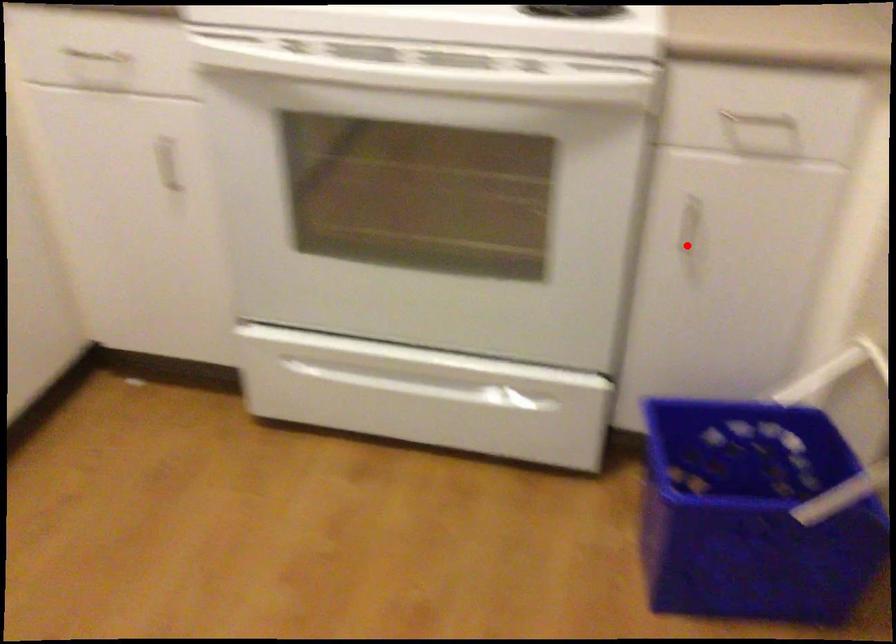
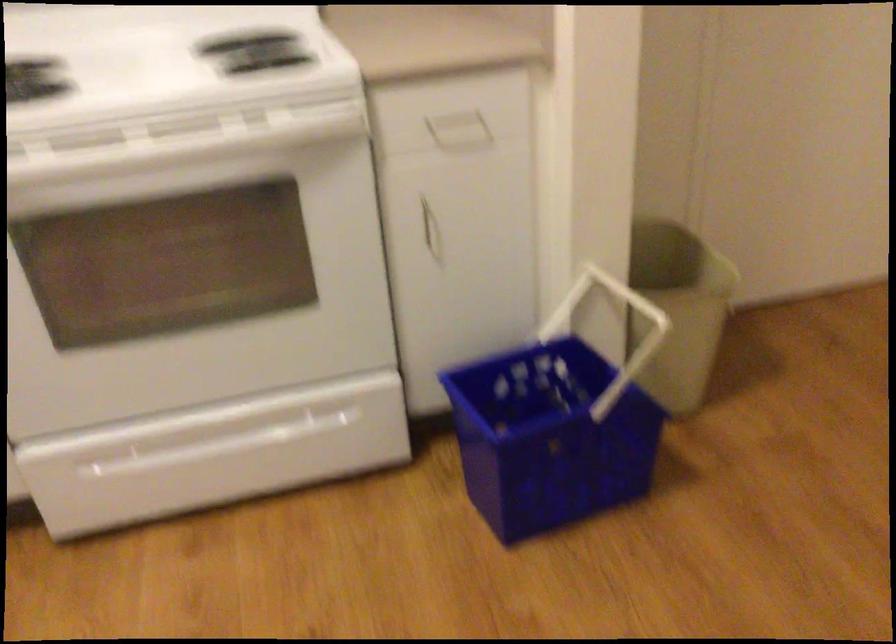
Question: A red point is marked in image1. In image2, is the corresponding 3D point closer to the camera or farther? Reply with the corresponding letter.

Choices:
 (A) The corresponding 3D point is closer.
 (B) The corresponding 3D point is farther.

Answer: (B)